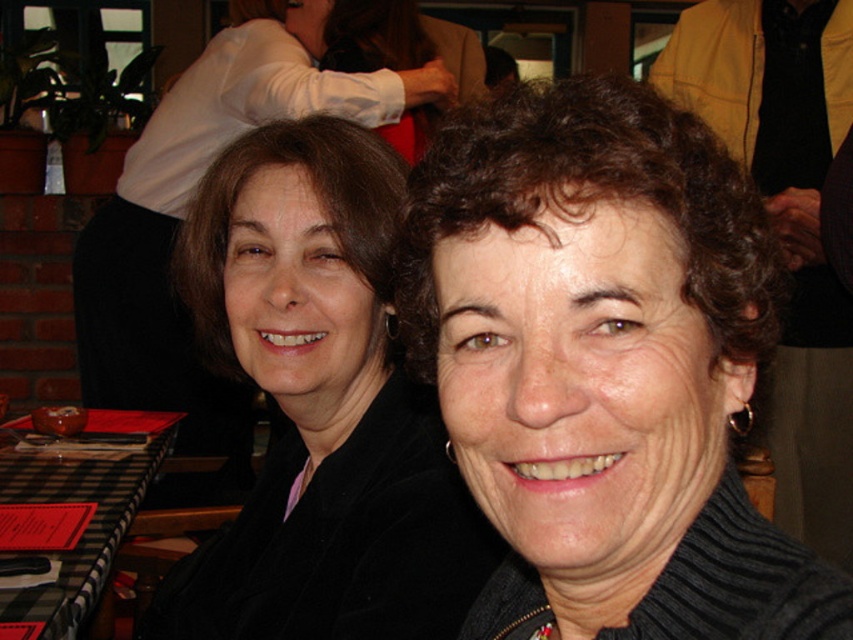
You are a photographer trying to capture a closeup of the dark brown curly hair at center. Based on its position at point 0.573, 0.708, should you adjust your camera to focus more to the left or right?

The dark brown curly hair at center is located at point (602, 365), so you should adjust your camera to focus more to the right since the x coordinate 0.573 is closer to the right side of the image.

You are a photographer standing at point [570,436]. You want to take a photo of the two women so that they both are in focus. The camera you are using has a depth of field that can cover 14 inches. Will the two women be in focus in the photo?

The two women are 14.16 inches apart. Since the camera can cover 14 inches, they will be just slightly out of focus.